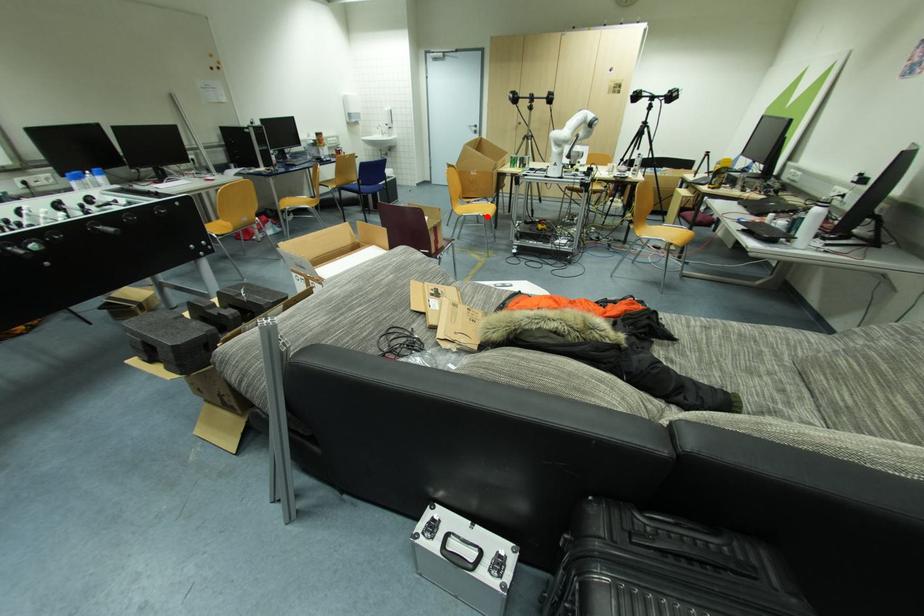
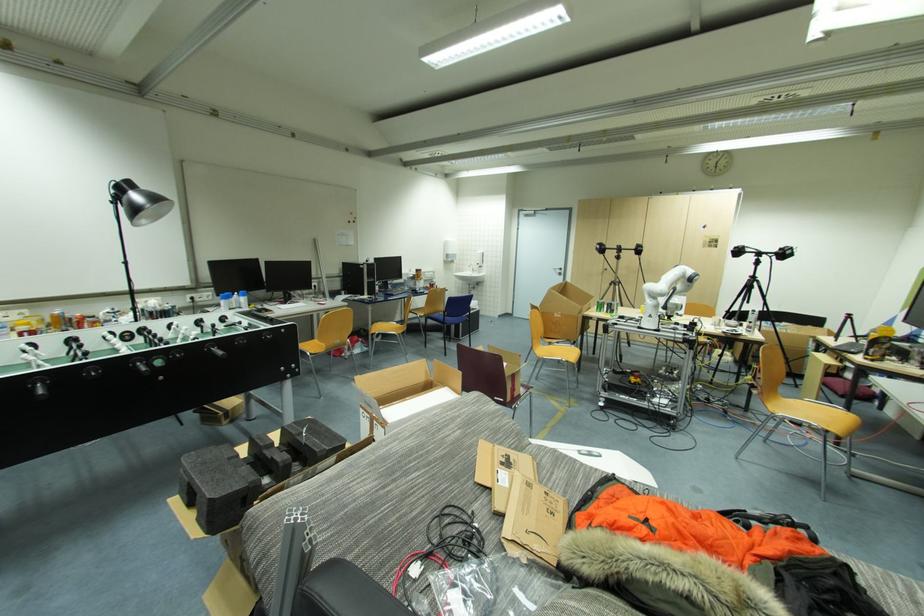
In the second image, find the point that corresponds to the highlighted location in the first image.

(570, 362)